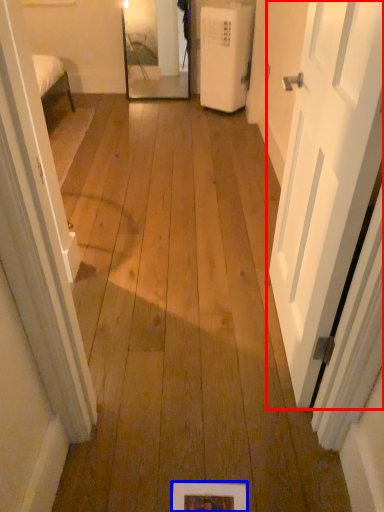
Question: Which object is further to the camera taking this photo, door (highlighted by a red box) or picture frame (highlighted by a blue box)?

Choices:
 (A) door
 (B) picture frame

Answer: (B)